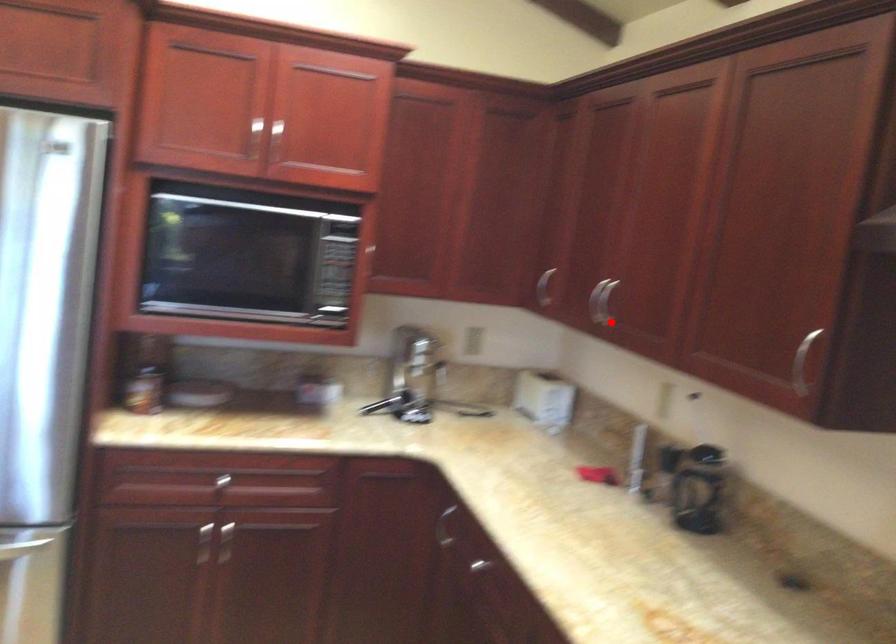
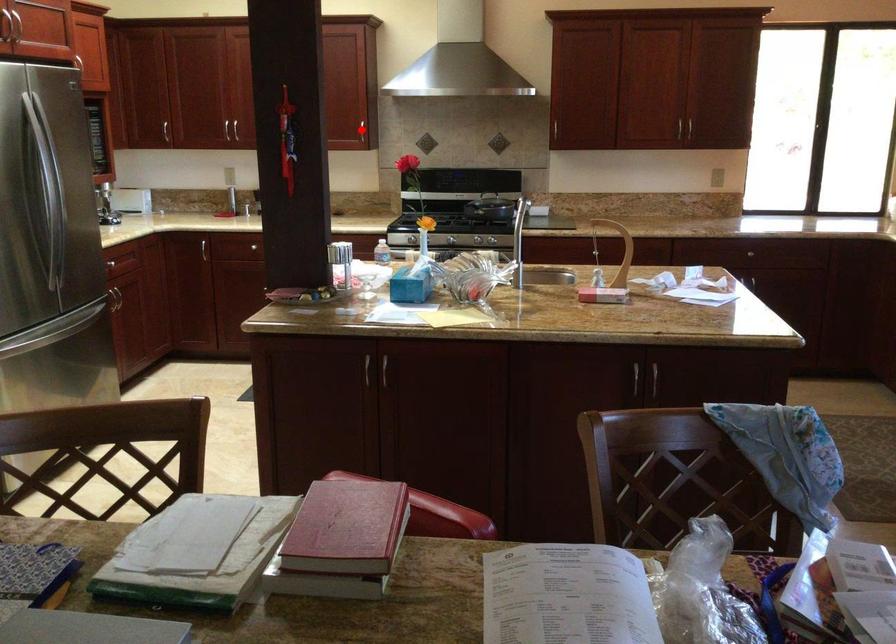
I am providing you with two images of the same scene from different viewpoints. A red point is marked on the first image and another point is marked on the second image. Are the points marked in image1 and image2 representing the same 3D position?

No